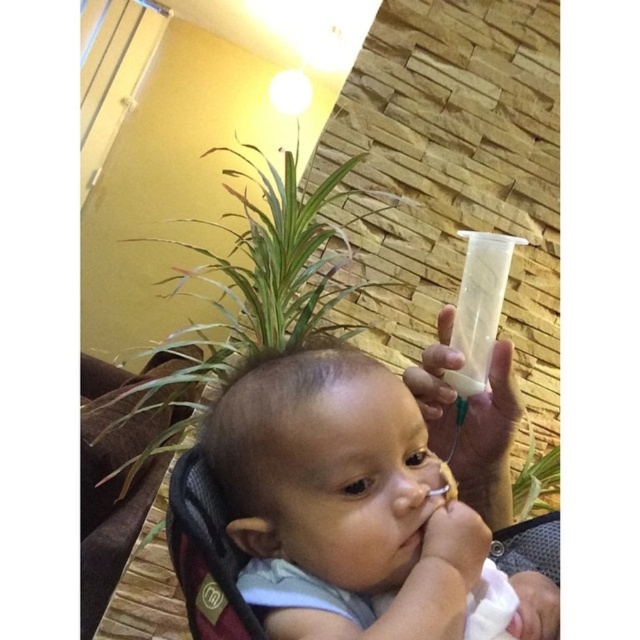
Does point (467, 554) lie behind point (392, 280)?

No.

At what (x,y) coordinates should I click in order to perform the action: click on smooth plastic bottle at upper right. Please return your answer as a coordinate pair (x, y). The width and height of the screenshot is (640, 640). Looking at the image, I should click on (340, 499).

Can you confirm if smooth plastic bottle at upper right is thinner than green leafy plant at center?

No, smooth plastic bottle at upper right is not thinner than green leafy plant at center.

Based on the photo, can you confirm if smooth plastic bottle at upper right is wider than green leafy plant at center?

Indeed, smooth plastic bottle at upper right has a greater width compared to green leafy plant at center.

Which is behind, point (273, 544) or point (538, 515)?

Positioned behind is point (538, 515).

The image size is (640, 640). What are the coordinates of `smooth plastic bottle at upper right` in the screenshot? It's located at (340, 499).

The height and width of the screenshot is (640, 640). What do you see at coordinates (250, 294) in the screenshot?
I see `green leafy plant at upper left` at bounding box center [250, 294].

Does green leafy plant at upper left appear under green leafy plant at center?

Incorrect, green leafy plant at upper left is not positioned below green leafy plant at center.

Where is `green leafy plant at upper left`? green leafy plant at upper left is located at coordinates (250, 294).